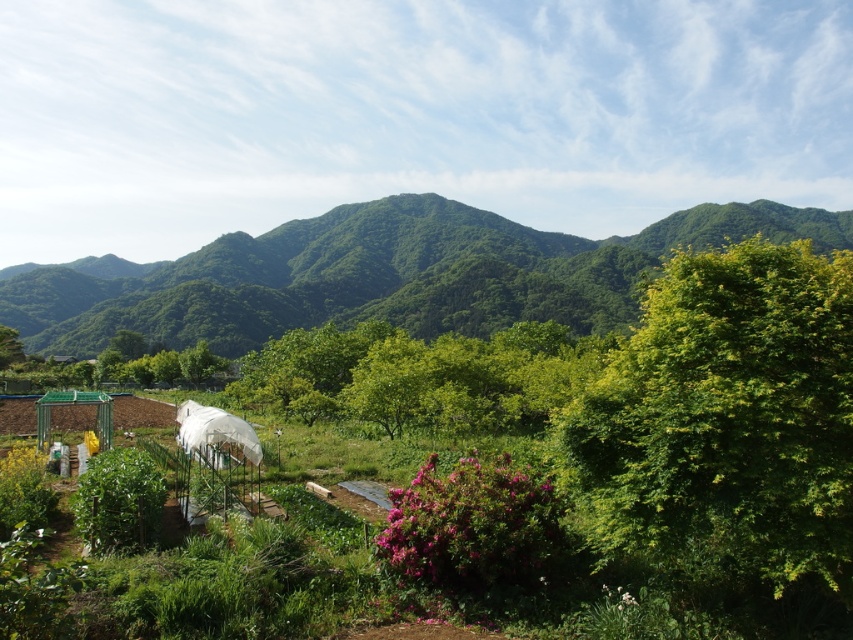
You are a gardener standing in the garden and need to water both the green plastic greenhouse at lower left and the green leafy mountain at upper center. Which object should you water first if you want to start with the one closer to you?

You should water the green plastic greenhouse at lower left first because it is closer to you than the green leafy mountain at upper center.

You are a gardener who wants to plant a new tree in the garden. You need to choose between planting it near the green plastic greenhouse at lower left or the green leafy mountain at upper center. Based on their positions, which location would provide more sunlight for the tree?

The green plastic greenhouse at lower left is positioned under green leafy mountain at upper center, so planting the tree near the green leafy mountain at upper center would provide more sunlight since it is higher and less obstructed by the greenhouse.